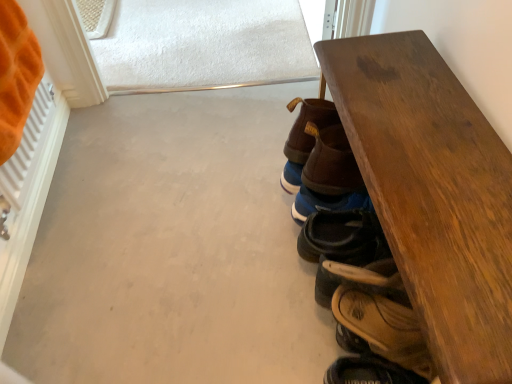
Measure the distance between brown leather shoe at center, marked as the fourth footwear in a bottom-to-top arrangement, and camera.

They are 37.64 inches apart.

You are a GUI agent. You are given a task and a screenshot of the screen. Output one action in this format:
    pyautogui.click(x=<x>, y=<y>)
    Task: Click on the brown leather sandal at lower right, which ranks as the 4th footwear in top-to-bottom order
    Image resolution: width=512 pixels, height=384 pixels.
    Given the screenshot: What is the action you would take?
    pyautogui.click(x=384, y=328)

The width and height of the screenshot is (512, 384). What do you see at coordinates (16, 75) in the screenshot?
I see `orange plush blanket at left` at bounding box center [16, 75].

Locate an element on the screen. brown leather shoe at center, marked as the first footwear in a top-to-bottom arrangement is located at coordinates (304, 137).

Looking at this image, between leather sandal at lower right, the third footwear positioned from the top, and brown leather sandal at lower right, acting as the 1th footwear starting from the bottom, which one appears on the right side from the viewer's perspective?

Positioned to the right is brown leather sandal at lower right, acting as the 1th footwear starting from the bottom.

Which is farther, (x=367, y=285) or (x=353, y=314)?

Point (x=367, y=285)

Is leather sandal at lower right, the third footwear positioned from the top, inside or outside of brown leather sandal at lower right, which ranks as the 4th footwear in top-to-bottom order?

leather sandal at lower right, the third footwear positioned from the top, is located beyond the bounds of brown leather sandal at lower right, which ranks as the 4th footwear in top-to-bottom order.

Measure the distance from orange plush blanket at left to brown leather sandal at lower right, which ranks as the 4th footwear in top-to-bottom order.

orange plush blanket at left is 32.52 inches from brown leather sandal at lower right, which ranks as the 4th footwear in top-to-bottom order.

Between orange plush blanket at left and brown leather sandal at lower right, which ranks as the 4th footwear in top-to-bottom order, which one has more height?

orange plush blanket at left is taller.

Who is smaller, orange plush blanket at left or brown leather sandal at lower right, acting as the 1th footwear starting from the bottom?

brown leather sandal at lower right, acting as the 1th footwear starting from the bottom, is smaller.

Locate an element on the screen. blanket in front of the brown leather sandal at lower right, which ranks as the 4th footwear in top-to-bottom order is located at coordinates (16, 75).

Between point (366, 201) and point (24, 115), which one is positioned behind?

Point (366, 201)

Can we say blue suede shoes at lower right, the 3th footwear from the bottom, lies outside orange plush blanket at left?

Indeed, blue suede shoes at lower right, the 3th footwear from the bottom, is completely outside orange plush blanket at left.

Considering the relative positions of blue suede shoes at lower right, which ranks as the 2th footwear in top-to-bottom order, and orange plush blanket at left in the image provided, is blue suede shoes at lower right, which ranks as the 2th footwear in top-to-bottom order, to the right of orange plush blanket at left from the viewer's perspective?

Correct, you'll find blue suede shoes at lower right, which ranks as the 2th footwear in top-to-bottom order, to the right of orange plush blanket at left.

Based on the photo, from the image's perspective, would you say blue suede shoes at lower right, which ranks as the 2th footwear in top-to-bottom order, is shown under orange plush blanket at left?

Indeed, from the image's perspective, blue suede shoes at lower right, which ranks as the 2th footwear in top-to-bottom order, is shown beneath orange plush blanket at left.

From a real-world perspective, is brown leather sandal at lower right, acting as the 1th footwear starting from the bottom, located higher than leather sandal at lower right, which is the second footwear from bottom to top?

Actually, brown leather sandal at lower right, acting as the 1th footwear starting from the bottom, is physically below leather sandal at lower right, which is the second footwear from bottom to top, in the real world.

Locate an element on the screen. This screenshot has width=512, height=384. footwear located on the right of leather sandal at lower right, the third footwear positioned from the top is located at coordinates (384, 328).

Is point (391, 324) in front of point (328, 299)?

Yes, point (391, 324) is closer to viewer.

In the scene shown: From their relative heights in the image, would you say brown leather sandal at lower right, acting as the 1th footwear starting from the bottom, is taller or shorter than leather sandal at lower right, the third footwear positioned from the top?

Clearly, brown leather sandal at lower right, acting as the 1th footwear starting from the bottom, is shorter compared to leather sandal at lower right, the third footwear positioned from the top.

Between point (302, 126) and point (337, 205), which one is positioned in front?

The point (302, 126) is in front.

Does brown leather shoe at center, marked as the first footwear in a top-to-bottom arrangement, have a lesser width compared to blue suede shoes at lower right, which ranks as the 2th footwear in top-to-bottom order?

Yes, brown leather shoe at center, marked as the first footwear in a top-to-bottom arrangement, is thinner than blue suede shoes at lower right, which ranks as the 2th footwear in top-to-bottom order.

Which of these two, brown leather shoe at center, marked as the first footwear in a top-to-bottom arrangement, or blue suede shoes at lower right, which ranks as the 2th footwear in top-to-bottom order, stands taller?

brown leather shoe at center, marked as the first footwear in a top-to-bottom arrangement, is taller.

Are brown leather shoe at center, marked as the first footwear in a top-to-bottom arrangement, and blue suede shoes at lower right, the 3th footwear from the bottom, far apart?

No, brown leather shoe at center, marked as the first footwear in a top-to-bottom arrangement, is not far away from blue suede shoes at lower right, the 3th footwear from the bottom.

Based on the photo, who is bigger, brown leather shoe at center, marked as the fourth footwear in a bottom-to-top arrangement, or brown leather sandal at lower right, acting as the 1th footwear starting from the bottom?

brown leather shoe at center, marked as the fourth footwear in a bottom-to-top arrangement.

Who is more distant, brown leather shoe at center, marked as the fourth footwear in a bottom-to-top arrangement, or brown leather sandal at lower right, which ranks as the 4th footwear in top-to-bottom order?

brown leather shoe at center, marked as the fourth footwear in a bottom-to-top arrangement, is further from the camera.

Who is taller, brown leather shoe at center, marked as the first footwear in a top-to-bottom arrangement, or brown leather sandal at lower right, acting as the 1th footwear starting from the bottom?

Standing taller between the two is brown leather shoe at center, marked as the first footwear in a top-to-bottom arrangement.

From a real-world perspective, is brown leather shoe at center, marked as the first footwear in a top-to-bottom arrangement, physically below brown leather sandal at lower right, acting as the 1th footwear starting from the bottom?

No, from a real-world perspective, brown leather shoe at center, marked as the first footwear in a top-to-bottom arrangement, is not under brown leather sandal at lower right, acting as the 1th footwear starting from the bottom.

At what (x,y) coordinates should I click in order to perform the action: click on the 1st footwear above the wooden table at right (from the image's perspective). Please return your answer as a coordinate pair (x, y). Looking at the image, I should click on 327,203.

Is wooden table at right a part of blue suede shoes at lower right, the 3th footwear from the bottom?

No, wooden table at right is not inside blue suede shoes at lower right, the 3th footwear from the bottom.

From a real-world perspective, between blue suede shoes at lower right, which ranks as the 2th footwear in top-to-bottom order, and wooden table at right, who is vertically lower?

blue suede shoes at lower right, which ranks as the 2th footwear in top-to-bottom order, is physically lower.

Is blue suede shoes at lower right, the 3th footwear from the bottom, facing towards wooden table at right?

No, blue suede shoes at lower right, the 3th footwear from the bottom, is not oriented towards wooden table at right.

I want to click on the 1st footwear below the leather sandal at lower right, the third footwear positioned from the top (from a real-world perspective), so click(x=384, y=328).

Identify the location of blanket above the brown leather sandal at lower right, which ranks as the 4th footwear in top-to-bottom order (from the image's perspective). (16, 75).

Consider the image. Which object lies nearer to the anchor point wooden table at right, blue suede shoes at lower right, the 3th footwear from the bottom, or leather sandal at lower right, which is the second footwear from bottom to top?

leather sandal at lower right, which is the second footwear from bottom to top, is closer to wooden table at right.

Looking at the image, which one is located further to brown leather shoe at center, marked as the fourth footwear in a bottom-to-top arrangement, brown leather sandal at lower right, which ranks as the 4th footwear in top-to-bottom order, or leather sandal at lower right, which is the second footwear from bottom to top?

The object further to brown leather shoe at center, marked as the fourth footwear in a bottom-to-top arrangement, is brown leather sandal at lower right, which ranks as the 4th footwear in top-to-bottom order.

Estimate the real-world distances between objects in this image. Which object is closer to blue suede shoes at lower right, the 3th footwear from the bottom, brown leather sandal at lower right, acting as the 1th footwear starting from the bottom, or orange plush blanket at left?

Among the two, brown leather sandal at lower right, acting as the 1th footwear starting from the bottom, is located nearer to blue suede shoes at lower right, the 3th footwear from the bottom.

Estimate the real-world distances between objects in this image. Which object is closer to brown leather sandal at lower right, which ranks as the 4th footwear in top-to-bottom order, leather sandal at lower right, which is the second footwear from bottom to top, or wooden table at right?

leather sandal at lower right, which is the second footwear from bottom to top, is positioned closer to the anchor brown leather sandal at lower right, which ranks as the 4th footwear in top-to-bottom order.

Estimate the real-world distances between objects in this image. Which object is closer to brown leather shoe at center, marked as the first footwear in a top-to-bottom arrangement, wooden table at right or brown leather sandal at lower right, which ranks as the 4th footwear in top-to-bottom order?

wooden table at right lies closer to brown leather shoe at center, marked as the first footwear in a top-to-bottom arrangement, than the other object.

From the image, which object appears to be nearer to brown leather shoe at center, marked as the fourth footwear in a bottom-to-top arrangement, leather sandal at lower right, the third footwear positioned from the top, or orange plush blanket at left?

Among the two, leather sandal at lower right, the third footwear positioned from the top, is located nearer to brown leather shoe at center, marked as the fourth footwear in a bottom-to-top arrangement.

When comparing their distances from wooden table at right, does blue suede shoes at lower right, which ranks as the 2th footwear in top-to-bottom order, or orange plush blanket at left seem closer?

blue suede shoes at lower right, which ranks as the 2th footwear in top-to-bottom order, is positioned closer to the anchor wooden table at right.

Which object lies further to the anchor point leather sandal at lower right, which is the second footwear from bottom to top, brown leather sandal at lower right, acting as the 1th footwear starting from the bottom, or orange plush blanket at left?

The object further to leather sandal at lower right, which is the second footwear from bottom to top, is orange plush blanket at left.

You are a GUI agent. You are given a task and a screenshot of the screen. Output one action in this format:
    pyautogui.click(x=<x>, y=<y>)
    Task: Click on the footwear between wooden table at right and brown leather sandal at lower right, acting as the 1th footwear starting from the bottom, from front to back
    Image resolution: width=512 pixels, height=384 pixels.
    Given the screenshot: What is the action you would take?
    pyautogui.click(x=359, y=280)

In order to click on footwear located between orange plush blanket at left and blue suede shoes at lower right, which ranks as the 2th footwear in top-to-bottom order, in the left-right direction in this screenshot , I will do `click(304, 137)`.

This screenshot has height=384, width=512. What are the coordinates of `footwear between brown leather shoe at center, marked as the first footwear in a top-to-bottom arrangement, and leather sandal at lower right, the third footwear positioned from the top, from top to bottom` in the screenshot? It's located at (327, 203).